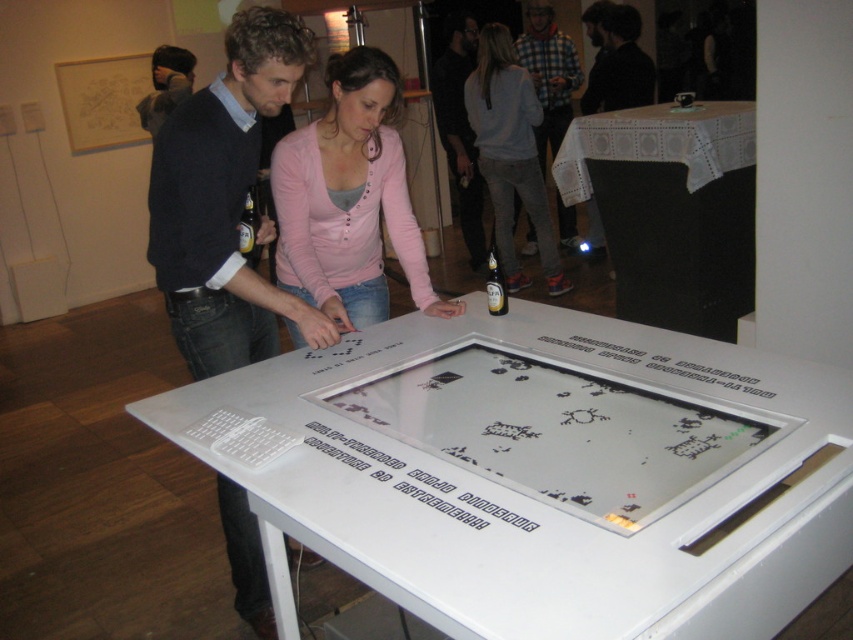
Is black matte shirt at center positioned before clear glass bottle at center?

No, black matte shirt at center is behind clear glass bottle at center.

Is point (456, 92) positioned behind point (492, 246)?

Yes.

Find the location of a particular element. black matte shirt at center is located at coordinates (460, 129).

Who is positioned more to the left, white lace tablecloth at upper right or black matte shirt at center?

black matte shirt at center is more to the left.

Can you confirm if white lace tablecloth at upper right is positioned below black matte shirt at center?

Yes.

What do you see at coordinates (671, 209) in the screenshot?
I see `white lace tablecloth at upper right` at bounding box center [671, 209].

What are the coordinates of `white lace tablecloth at upper right` in the screenshot? It's located at (671, 209).

Does dark gray sweater at center lie behind translucent glass bottle at center?

No, it is in front of translucent glass bottle at center.

Is dark gray sweater at center to the right of translucent glass bottle at center from the viewer's perspective?

Yes, dark gray sweater at center is to the right of translucent glass bottle at center.

Which is in front, point (296, 28) or point (254, 227)?

Point (296, 28) is more forward.

Locate an element on the screen. Image resolution: width=853 pixels, height=640 pixels. dark gray sweater at center is located at coordinates (225, 202).